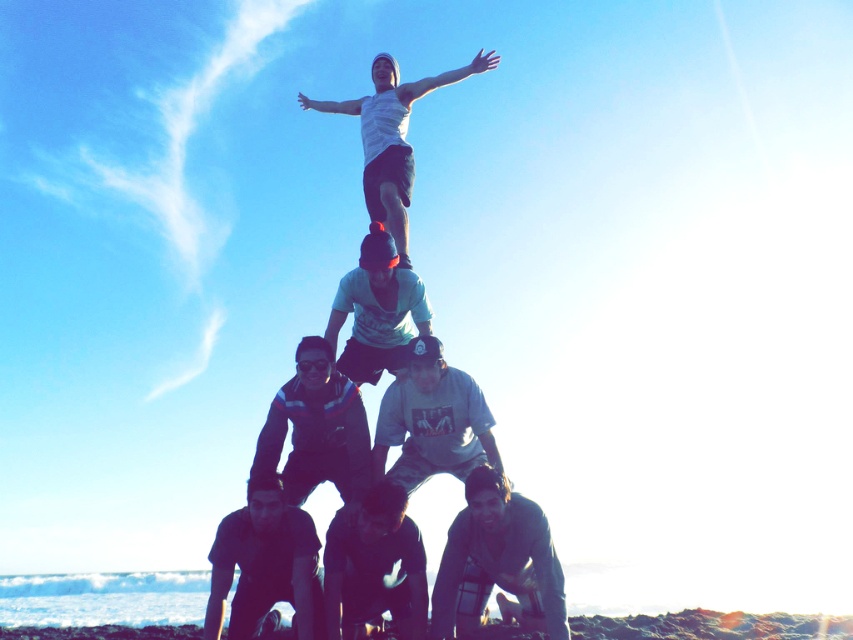
In the scene shown: You are a photographer trying to capture the human pyramid from the beach. You notice the dark gray fabric at lower right and the white cotton shirt at center. Which object should you focus on first if you want to ensure both are in the frame without moving the camera?

You should focus on the white cotton shirt at center first because the dark gray fabric at lower right is to the right of it, so centering the white cotton shirt ensures both are within the frame.

You are a photographer trying to capture the human pyramid from the beach. You notice two items in the scene that might affect your shot. The dark gray fabric at lower right and the white cotton shirt at center. Which of these items is more likely to cause glare from the low sun, and why?

The dark gray fabric at lower right is thinner than the white cotton shirt at center. Since darker colors absorb more light and thin materials may allow more light to reflect off surfaces beneath them, the dark gray fabric could create more glare under the low sun.

You are a photographer trying to capture the human pyramid from the beach. You notice the dark gray fabric at lower right and the white cotton shirt at center. Which object is closer to the camera?

The dark gray fabric at lower right is located below the white cotton shirt at center, so the white cotton shirt at center is closer to the camera.